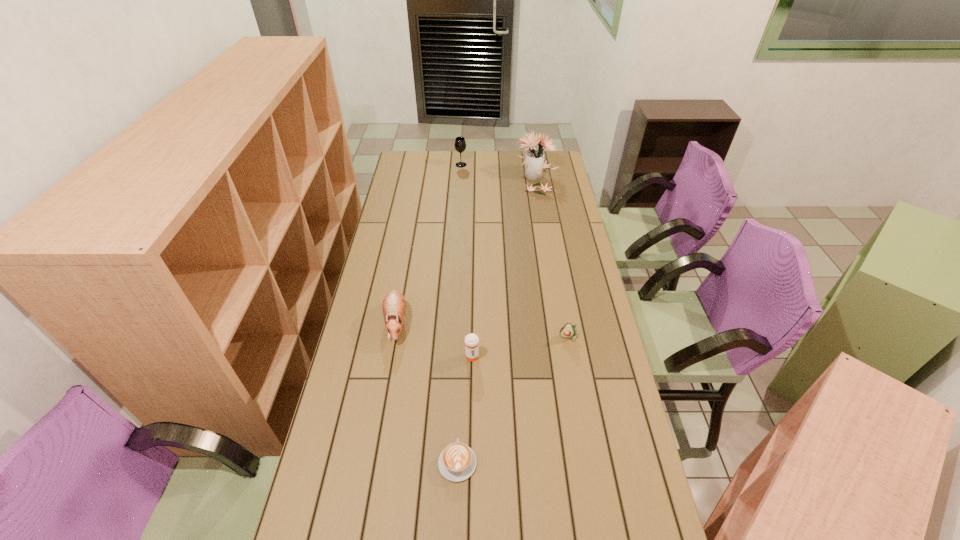
This screenshot has width=960, height=540. In order to click on vacant area located on the right of the second nearest object in this screenshot , I will do `click(524, 356)`.

Locate an element on the screen. Image resolution: width=960 pixels, height=540 pixels. vacant area situated on the seed side of the avocado is located at coordinates (574, 363).

The height and width of the screenshot is (540, 960). I want to click on free point located 0.290m on the side of the cappuccino with the handle, so click(461, 359).

Locate an element on the screen. free space located on the side of the cappuccino with the handle is located at coordinates (462, 354).

At what (x,y) coordinates should I click in order to perform the action: click on free location located 0.100m on the side of the cappuccino with the handle. Please return your answer as a coordinate pair (x, y). Looking at the image, I should click on (459, 411).

Where is `bouquet situated at the far edge`? The height and width of the screenshot is (540, 960). bouquet situated at the far edge is located at coordinates (534, 163).

Where is `wineglass located in the far edge section of the desktop`? wineglass located in the far edge section of the desktop is located at coordinates (460, 144).

I want to click on object present at the left edge, so click(394, 304).

I want to click on bouquet that is at the right edge, so click(534, 163).

At what (x,y) coordinates should I click in order to perform the action: click on avocado at the right edge. Please return your answer as a coordinate pair (x, y). Looking at the image, I should click on (568, 330).